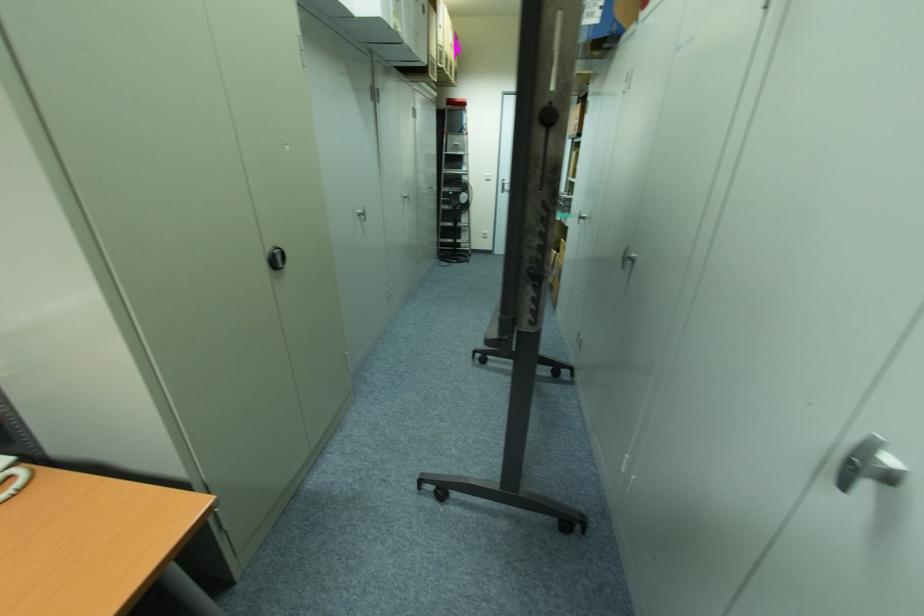
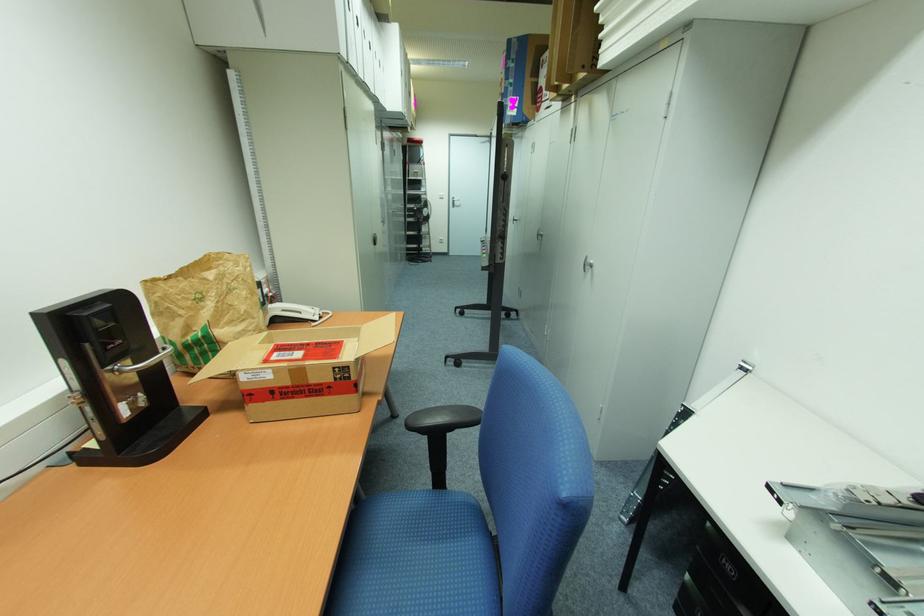
What movement of the cameraman would produce the second image?

The movement direction of the cameraman is left, backward.